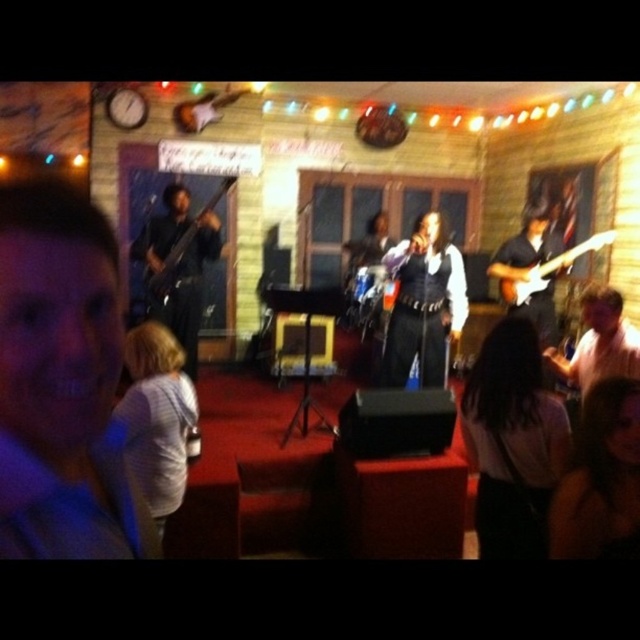
You are a stagehand setting up microphones for the instruments. The white glossy electric guitar at right requires a thinner microphone stand than the matte black bass at left. Which instrument should you place the thinner stand next to?

The white glossy electric guitar at right is thinner than the matte black bass at left, so the thinner microphone stand should be placed next to the white glossy electric guitar at right.